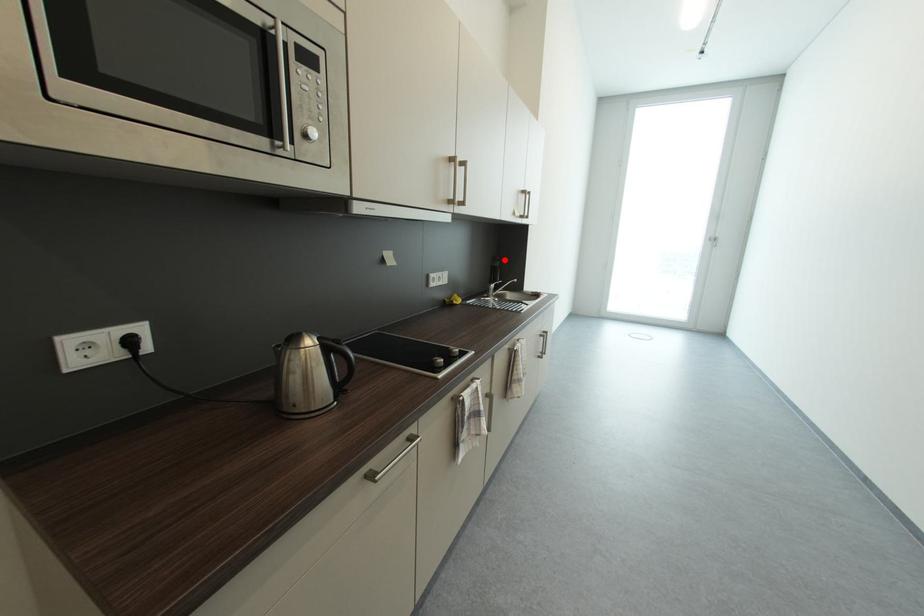
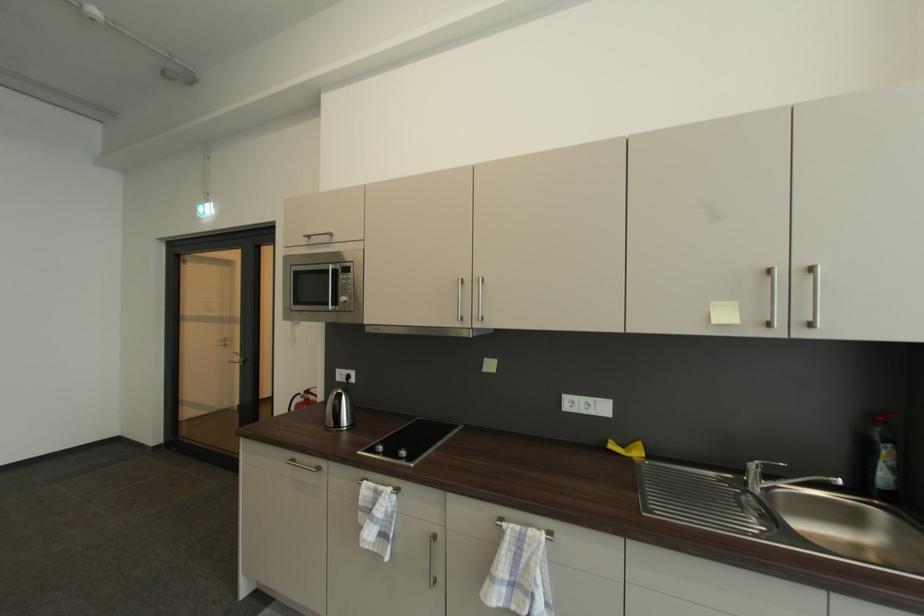
Locate, in the second image, the point that corresponds to the highlighted location in the first image.

(885, 419)